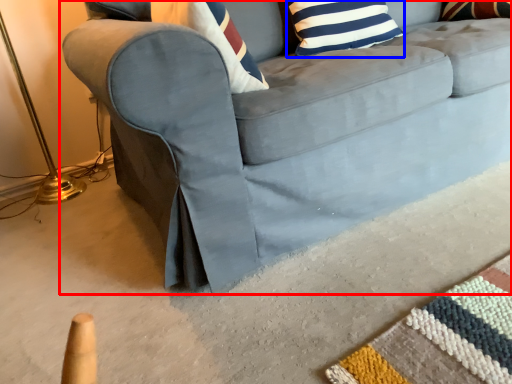
Question: Which of the following is the farthest to the observer, studio couch (highlighted by a red box) or pillow (highlighted by a blue box)?

Choices:
 (A) studio couch
 (B) pillow

Answer: (B)